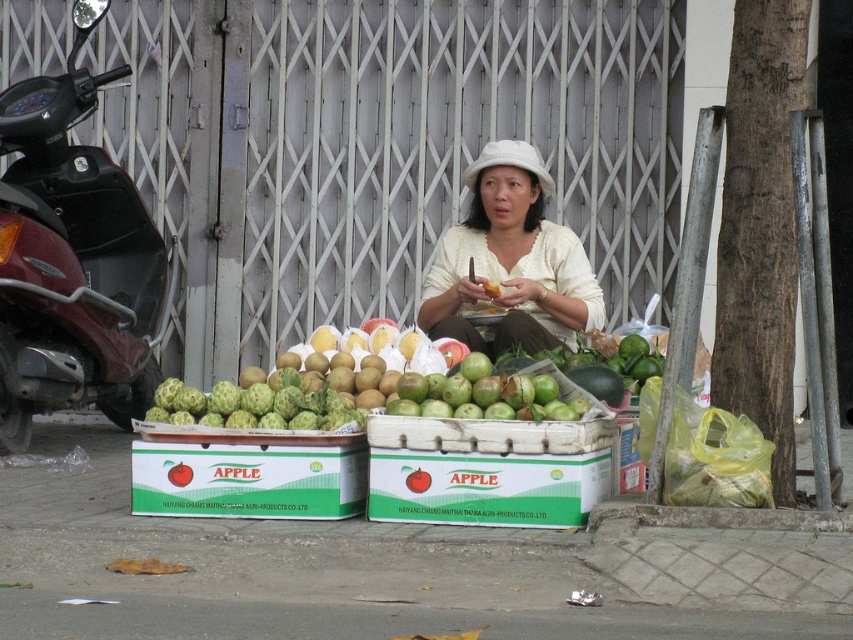
Question: Which of the following is the closest to the observer?

Choices:
 (A) (524, 400)
 (B) (57, 376)

Answer: (A)

Question: Is green plastic crates at lower center positioned in front of white matte hat at center?

Choices:
 (A) yes
 (B) no

Answer: (A)

Question: Is green plastic crates at lower center above maroon metallic motorcycle at left?

Choices:
 (A) yes
 (B) no

Answer: (B)

Question: Estimate the real-world distances between objects in this image. Which object is closer to the green rough skin at center?

Choices:
 (A) white matte hat at center
 (B) green matte apple box at center
 (C) green plastic crates at lower center

Answer: (B)

Question: Does maroon metallic motorcycle at left appear on the right side of white matte hat at center?

Choices:
 (A) no
 (B) yes

Answer: (A)

Question: Which object appears closest to the camera in this image?

Choices:
 (A) green matte apple box at center
 (B) white matte hat at center

Answer: (A)